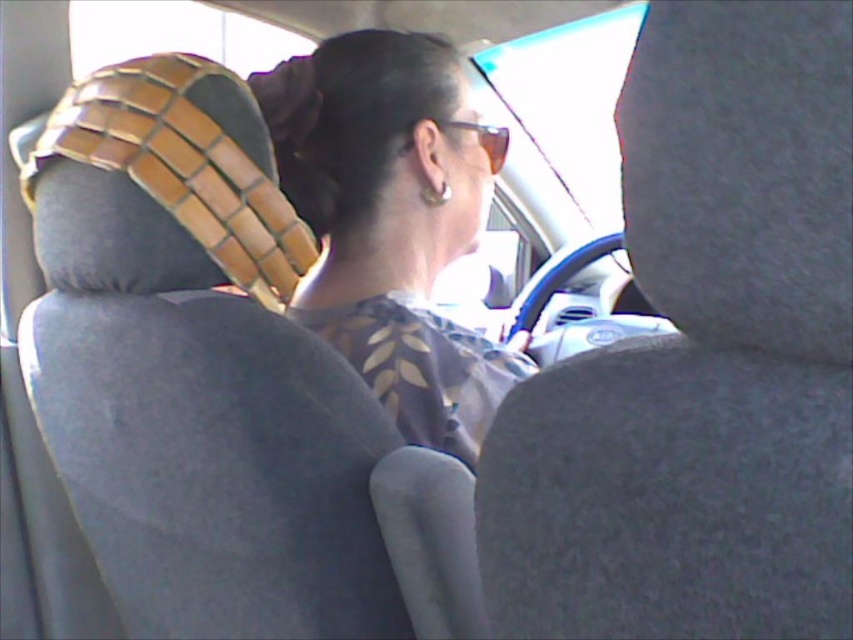
You are a passenger in the car and need to place your sunglasses on the seat. Based on the scene, can the sunglasses at center fit on the gray fabric seat at center without falling off?

The gray fabric seat at center has a greater height compared to sunglasses at center, so the sunglasses at center can be placed on the gray fabric seat at center without falling off.

You are sitting in the back seat of the car and want to place a small bag on the gray fabric seat at center. Based on the coordinates provided, where exactly should you aim to place it?

The gray fabric seat at center should be placed at the coordinates point [700,358] according to the description.